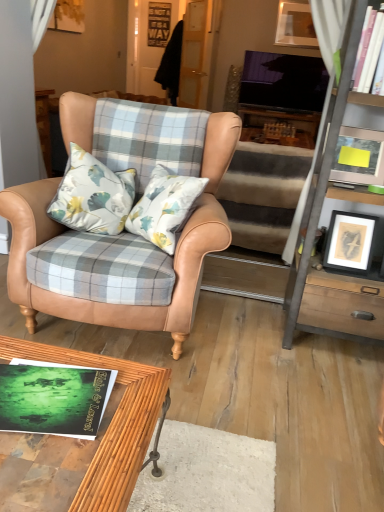
I want to click on free space in front of green matte book at lower left, so click(x=54, y=471).